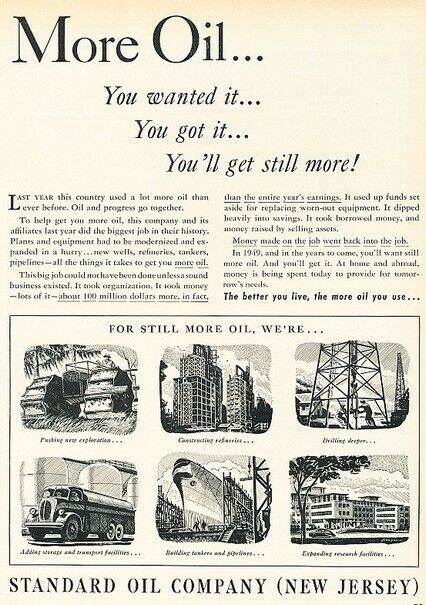
Where is `space between columns`? The width and height of the screenshot is (426, 605). space between columns is located at coordinates (217, 198), (217, 217), (215, 253), (216, 276), (215, 293), (215, 236).